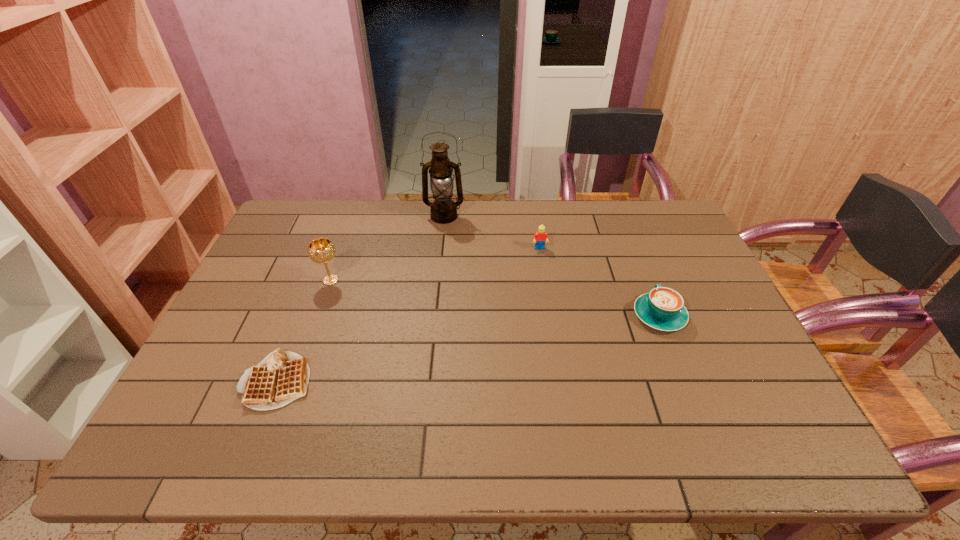
The image size is (960, 540). Identify the location of free spot between the farthest object and the fourth nearest object. (492, 233).

Locate an element on the screen. This screenshot has width=960, height=540. free spot between the nearest object and the fourth tallest object is located at coordinates (468, 348).

At what (x,y) coordinates should I click in order to perform the action: click on free space that is in between the nearest object and the oil lamp. Please return your answer as a coordinate pair (x, y). The width and height of the screenshot is (960, 540). Looking at the image, I should click on (361, 299).

Identify the location of free space between the waffle and the rightmost object. (468, 348).

Identify the location of free space between the third object from right to left and the shortest object. (361, 299).

Locate an element on the screen. The width and height of the screenshot is (960, 540). free area in between the rightmost object and the fourth shortest object is located at coordinates (495, 298).

Where is `free spot between the third tallest object and the fourth shortest object`? This screenshot has width=960, height=540. free spot between the third tallest object and the fourth shortest object is located at coordinates (435, 265).

I want to click on the fourth closest object to the shortest object, so click(663, 308).

What are the coordinates of `the third closest object to the farthest object` in the screenshot? It's located at (281, 377).

Where is `free location that satisfies the following two spatial constraints: 1. on the back side of the tallest object; 2. on the left side of the shortest object`? Image resolution: width=960 pixels, height=540 pixels. free location that satisfies the following two spatial constraints: 1. on the back side of the tallest object; 2. on the left side of the shortest object is located at coordinates (342, 217).